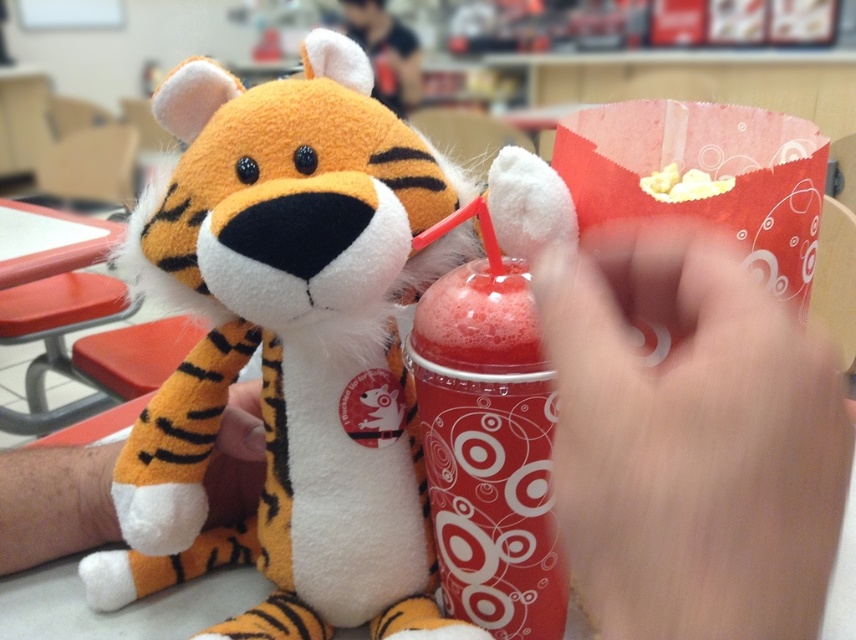
You are at a movie theater and see the translucent plastic cup at center and the yellow popcorn at upper center. Which one is taller?

The translucent plastic cup at center is much taller than the yellow popcorn at upper center.

You are holding a translucent plastic cup at center and want to place it on the table without knocking over the yellow popcorn at upper center. Based on their positions, is the cup already positioned in a safer spot closer to you than the popcorn?

The translucent plastic cup at center is closer to the viewer than the yellow popcorn at upper center, so placing it there would be safer as it is already in a closer position.